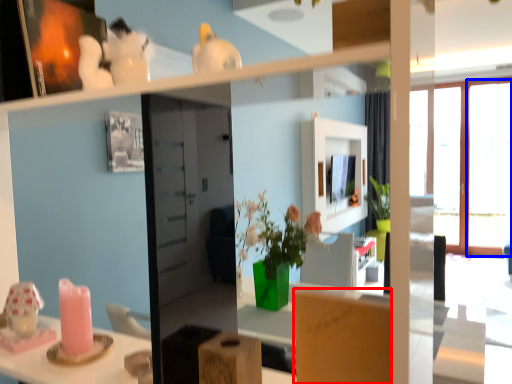
Question: Which object is closer to the camera taking this photo, cardboard box (highlighted by a red box) or window (highlighted by a blue box)?

Choices:
 (A) cardboard box
 (B) window

Answer: (A)